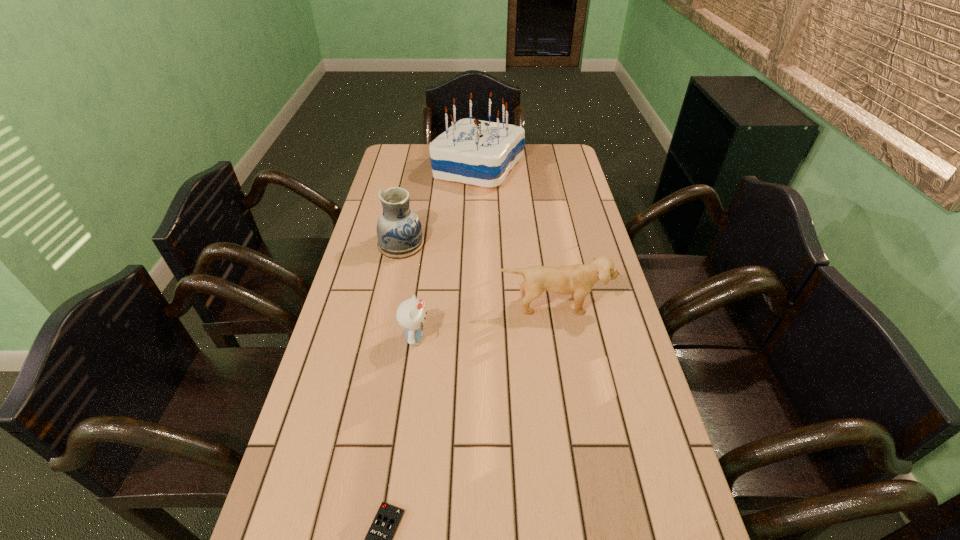
Identify the location of vacant region located on the front-facing side of the kitten. This screenshot has width=960, height=540. (519, 338).

The image size is (960, 540). I want to click on object positioned at the far edge, so click(482, 153).

This screenshot has width=960, height=540. I want to click on object situated at the left edge, so click(399, 231).

The image size is (960, 540). In order to click on object located in the right edge section of the desktop in this screenshot , I will do `click(578, 279)`.

Where is `vacant space at the right edge of the desktop`? vacant space at the right edge of the desktop is located at coordinates (590, 348).

In order to click on vacant space at the far left corner of the desktop in this screenshot , I will do `click(403, 168)`.

This screenshot has height=540, width=960. I want to click on free space that is in between the puppy and the birthday cake, so click(516, 237).

You are a GUI agent. You are given a task and a screenshot of the screen. Output one action in this format:
    pyautogui.click(x=<x>, y=<y>)
    Task: Click on the free spot between the pottery and the fourth farthest object
    
    Given the screenshot: What is the action you would take?
    pyautogui.click(x=408, y=291)

This screenshot has height=540, width=960. Find the location of `empty space that is in between the third tallest object and the birthday cake`. empty space that is in between the third tallest object and the birthday cake is located at coordinates 516,237.

Where is `the closest object to the puppy`? Image resolution: width=960 pixels, height=540 pixels. the closest object to the puppy is located at coordinates (410, 314).